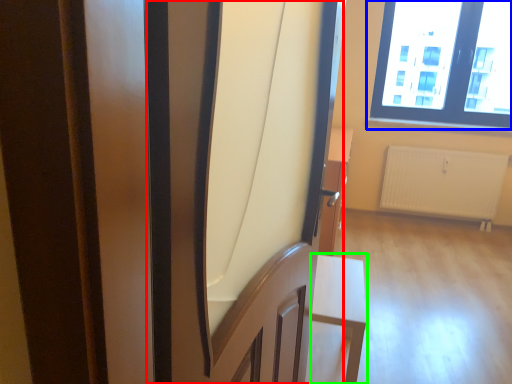
Question: Which is nearer to the screen door (highlighted by a red box)? window (highlighted by a blue box) or furniture (highlighted by a green box).

Choices:
 (A) window
 (B) furniture

Answer: (B)